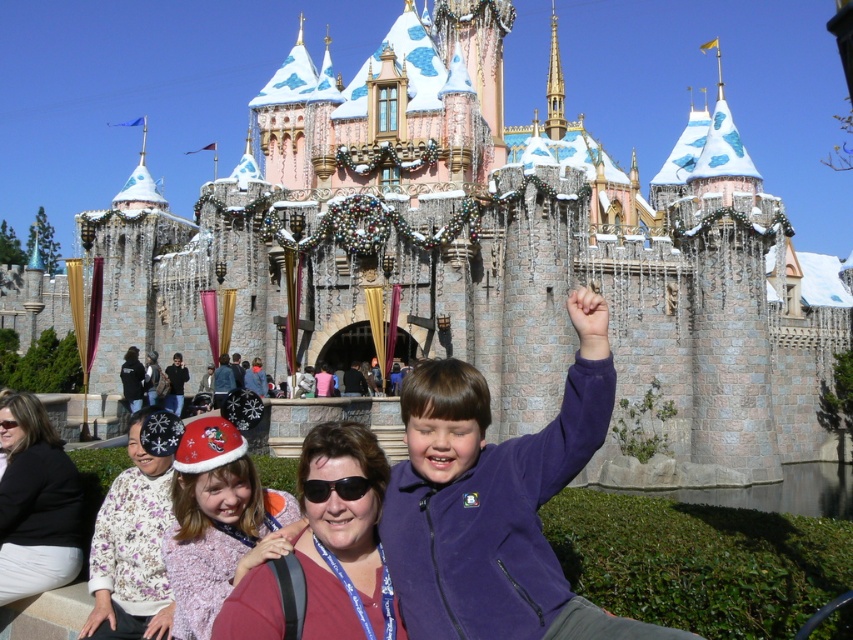
Can you confirm if purple fleece jacket at center is positioned below fuzzy pink sweater at lower left?

Incorrect, purple fleece jacket at center is not positioned below fuzzy pink sweater at lower left.

Image resolution: width=853 pixels, height=640 pixels. In order to click on purple fleece jacket at center in this screenshot , I will do pyautogui.click(x=495, y=502).

This screenshot has height=640, width=853. I want to click on purple fleece jacket at center, so click(x=495, y=502).

Does purple fleece jacket at center appear on the left side of matte black jacket at lower left?

Incorrect, purple fleece jacket at center is not on the left side of matte black jacket at lower left.

Locate an element on the screen. The width and height of the screenshot is (853, 640). purple fleece jacket at center is located at coordinates (495, 502).

Between purple fleece jacket at center and matte red shirt at center, which one appears on the left side from the viewer's perspective?

Positioned to the left is matte red shirt at center.

How distant is purple fleece jacket at center from matte red shirt at center?

purple fleece jacket at center is 4.62 meters from matte red shirt at center.

At what (x,y) coordinates should I click in order to perform the action: click on purple fleece jacket at center. Please return your answer as a coordinate pair (x, y). The width and height of the screenshot is (853, 640). Looking at the image, I should click on (495, 502).